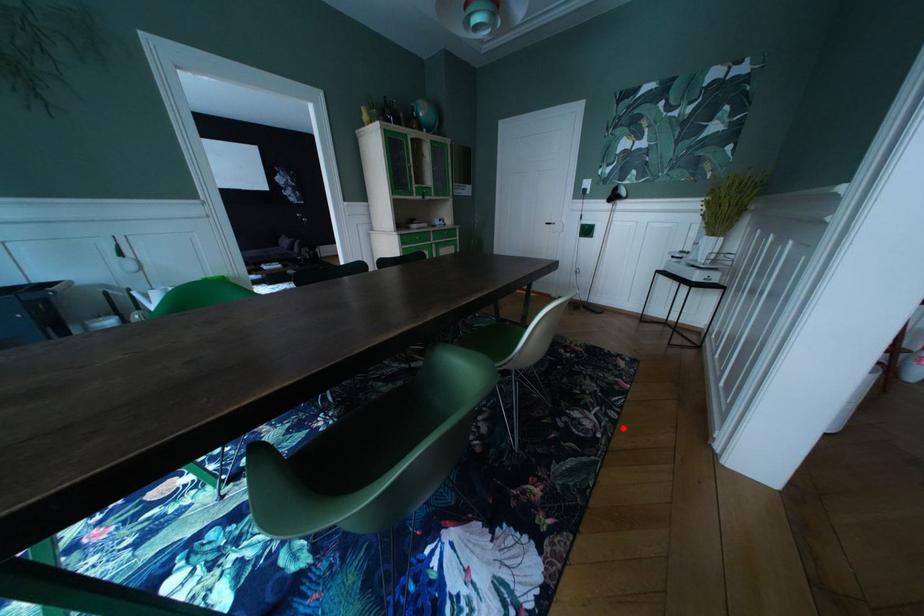
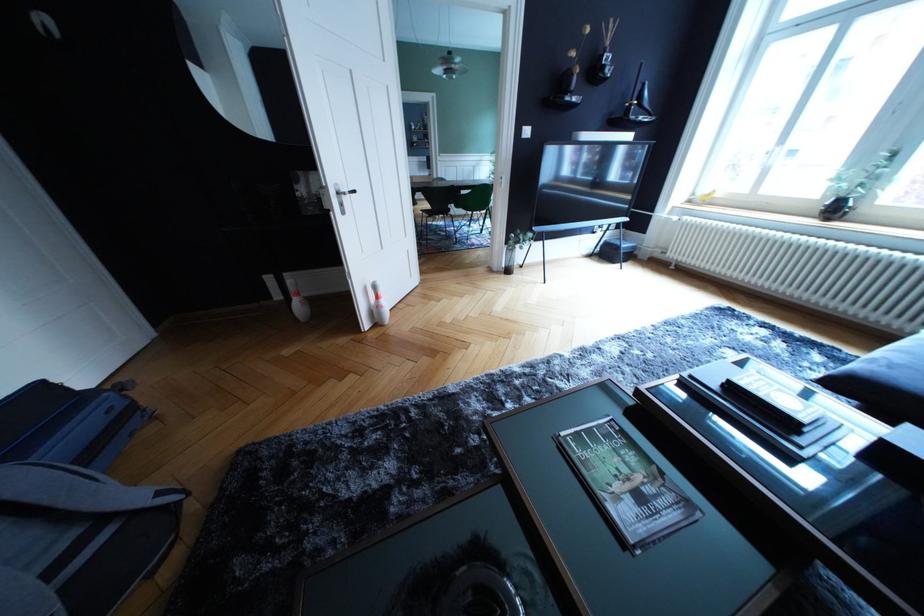
Question: I am providing you with two images of the same scene from different viewpoints. A red point is marked on the first image. Can you still see the location of the red point in image 2?

Choices:
 (A) Yes
 (B) No

Answer: (B)